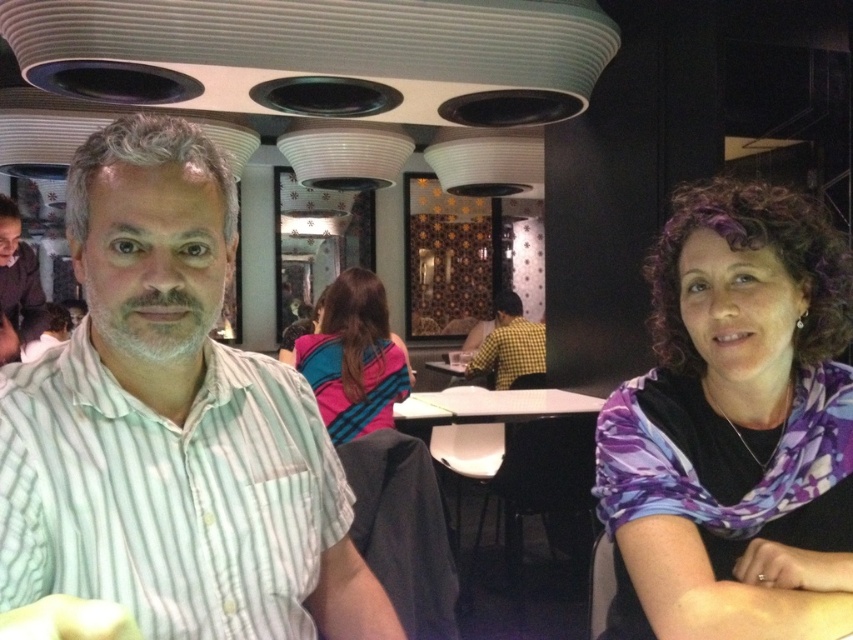
You are a fashion designer observing the two scarves in the image. Which scarf is smaller in size between the purple printed scarf at right and the blue striped scarf at center?

The purple printed scarf at right has a smaller size compared to the blue striped scarf at center.

You are a photographer setting up a shoot in this indoor location. You have a white glossy table at center and a matte black shirt at left in your frame. Considering their sizes, which object should you focus on first if you want to highlight the larger item in your composition?

The white glossy table at center has a larger size compared to the matte black shirt at left, so you should focus on the white glossy table at center first to highlight the larger item.

You are a photographer taking a portrait of two people sitting at a table. You notice the matte black shirt at left and the checkered fabric shirt at center. Which person should you ask to sit slightly higher to ensure both shirts appear at the same height in the photo?

The matte black shirt at left has a lesser height compared to checkered fabric shirt at center, so you should ask the person wearing the matte black shirt at left to sit slightly higher to balance their heights.